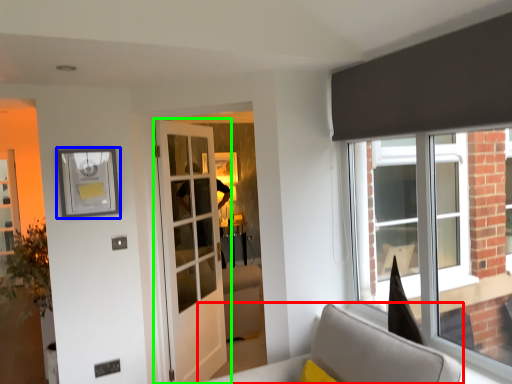
Question: Considering the real-world distances, which object is farthest from furniture (highlighted by a red box)? picture frame (highlighted by a blue box) or door (highlighted by a green box)?

Choices:
 (A) picture frame
 (B) door

Answer: (A)